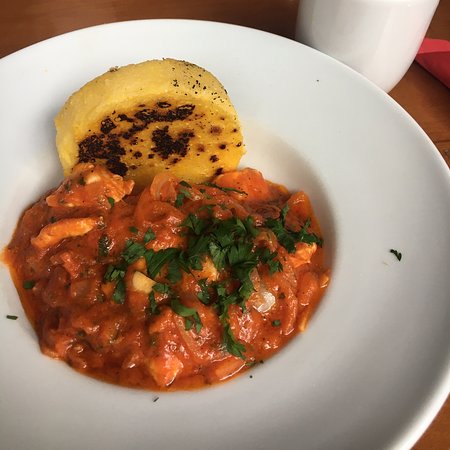
I want to click on brown table, so click(x=422, y=100).